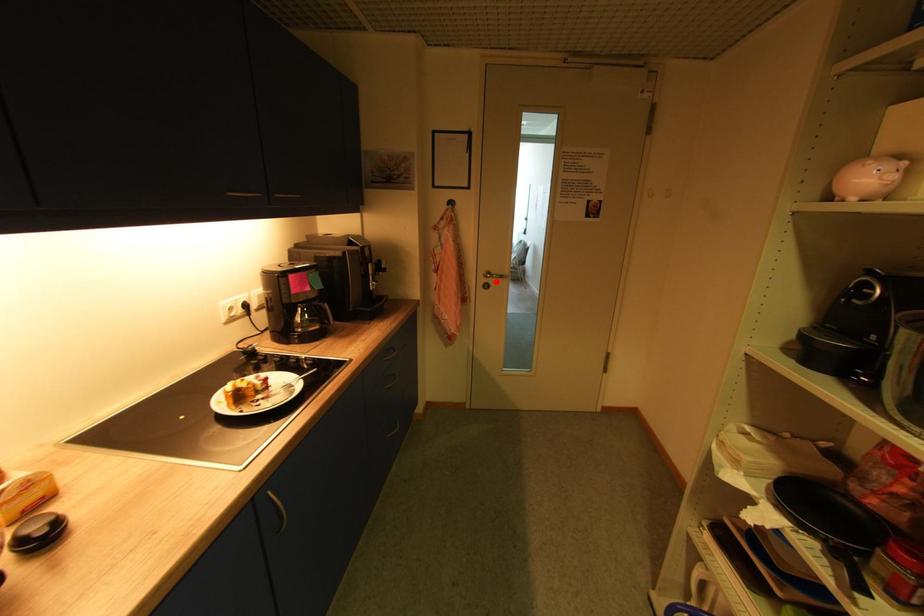
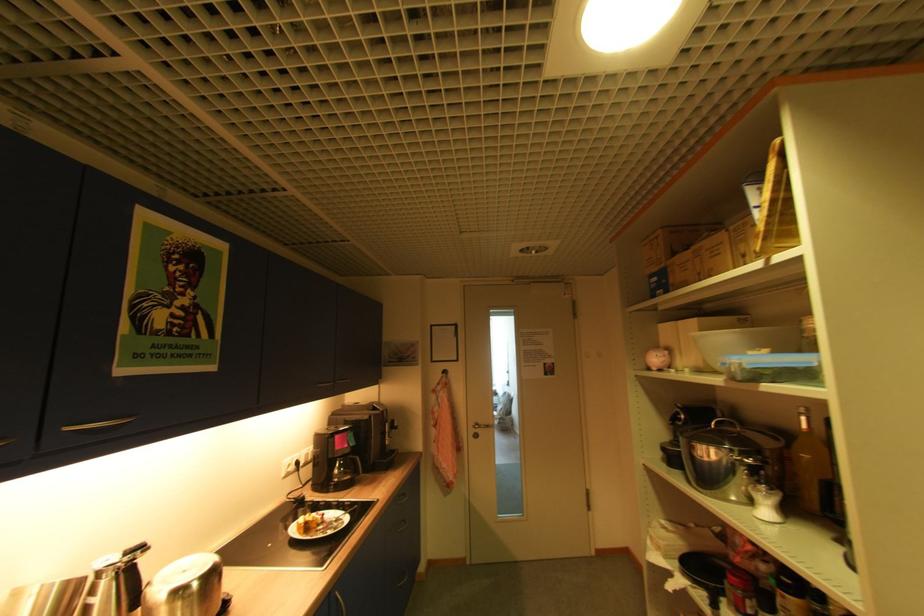
In the second image, find the point that corresponds to the highlighted location in the first image.

(484, 431)